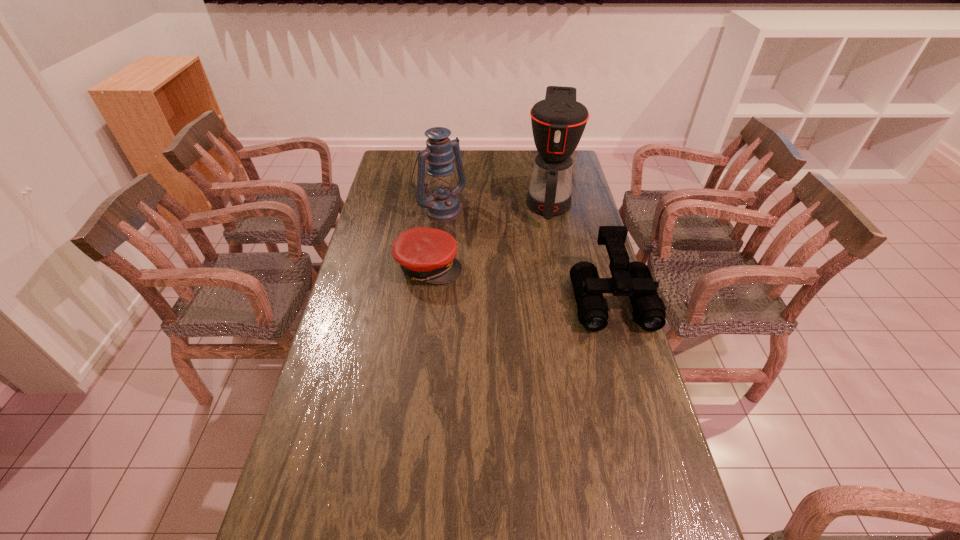
Locate an element on the screen. vacant space at the right edge is located at coordinates [591, 336].

At what (x,y) coordinates should I click in order to perform the action: click on vacant space at the far left corner of the desktop. Please return your answer as a coordinate pair (x, y). The height and width of the screenshot is (540, 960). Looking at the image, I should click on (418, 166).

Where is `free region at the far right corner`? The width and height of the screenshot is (960, 540). free region at the far right corner is located at coordinates (574, 155).

At what (x,y) coordinates should I click in order to perform the action: click on vacant space at the near right corner of the desktop. Please return your answer as a coordinate pair (x, y). The width and height of the screenshot is (960, 540). Looking at the image, I should click on (631, 524).

You are a GUI agent. You are given a task and a screenshot of the screen. Output one action in this format:
    pyautogui.click(x=<x>, y=<y>)
    Task: Click on the unoccupied area between the shortest object and the binoculars
    
    Given the screenshot: What is the action you would take?
    pyautogui.click(x=520, y=282)

Where is `blank region between the coffee maker and the binoculars`? The width and height of the screenshot is (960, 540). blank region between the coffee maker and the binoculars is located at coordinates (580, 249).

Where is `free space between the coffee maker and the cap`? The width and height of the screenshot is (960, 540). free space between the coffee maker and the cap is located at coordinates (489, 234).

The image size is (960, 540). Identify the location of empty location between the shortest object and the third tallest object. (520, 282).

Identify the location of free space that is in between the second shortest object and the cap. This screenshot has height=540, width=960. (520, 282).

You are a GUI agent. You are given a task and a screenshot of the screen. Output one action in this format:
    pyautogui.click(x=<x>, y=<y>)
    Task: Click on the vacant space that is in between the cap and the second shortest object
    
    Given the screenshot: What is the action you would take?
    pyautogui.click(x=520, y=282)